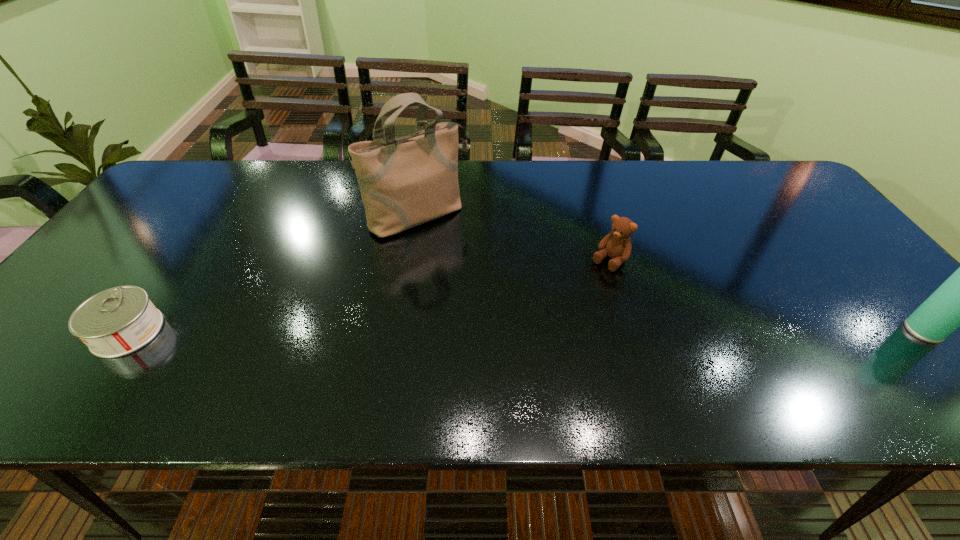
Find the location of a particular element. This screenshot has height=540, width=960. free space that is in between the can and the farthest object is located at coordinates (273, 274).

Locate an element on the screen. The width and height of the screenshot is (960, 540). free space that is in between the thermos bottle and the shoulder bag is located at coordinates (671, 273).

The height and width of the screenshot is (540, 960). Identify the location of vacant point located between the third shortest object and the farthest object. (671, 273).

Identify the location of empty space that is in between the rightmost object and the tallest object. Image resolution: width=960 pixels, height=540 pixels. (671, 273).

I want to click on free space between the rightmost object and the second shortest object, so click(x=766, y=296).

Where is `empty location between the shortest object and the thermos bottle`? The image size is (960, 540). empty location between the shortest object and the thermos bottle is located at coordinates (525, 331).

Locate an element on the screen. free point between the second farthest object and the second object from left to right is located at coordinates (514, 239).

Find the location of a particular element. This screenshot has width=960, height=540. free space that is in between the leftmost object and the tallest object is located at coordinates (273, 274).

Identify the location of blank region between the second object from right to left and the can. coord(369,296).

I want to click on object that stands as the third closest to the shortest object, so click(x=959, y=302).